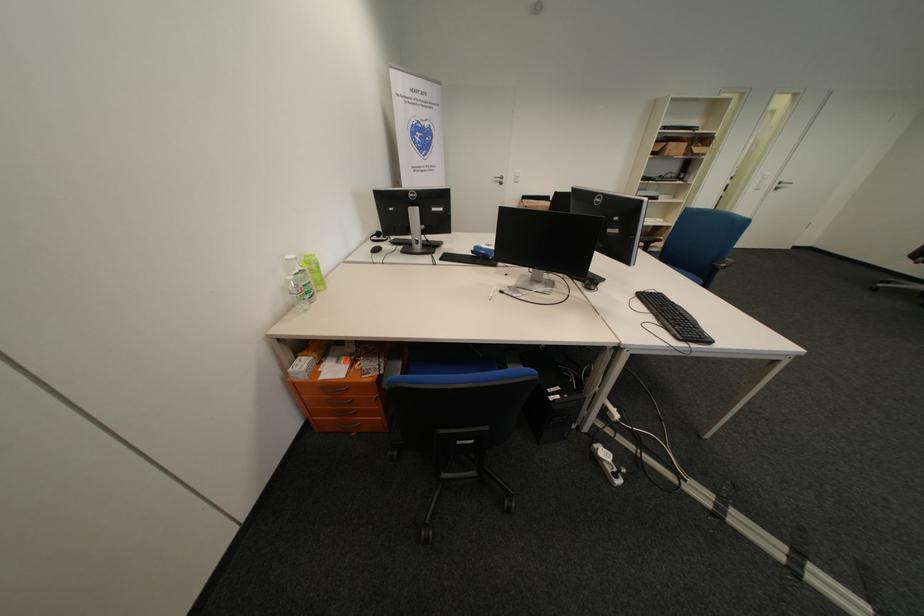
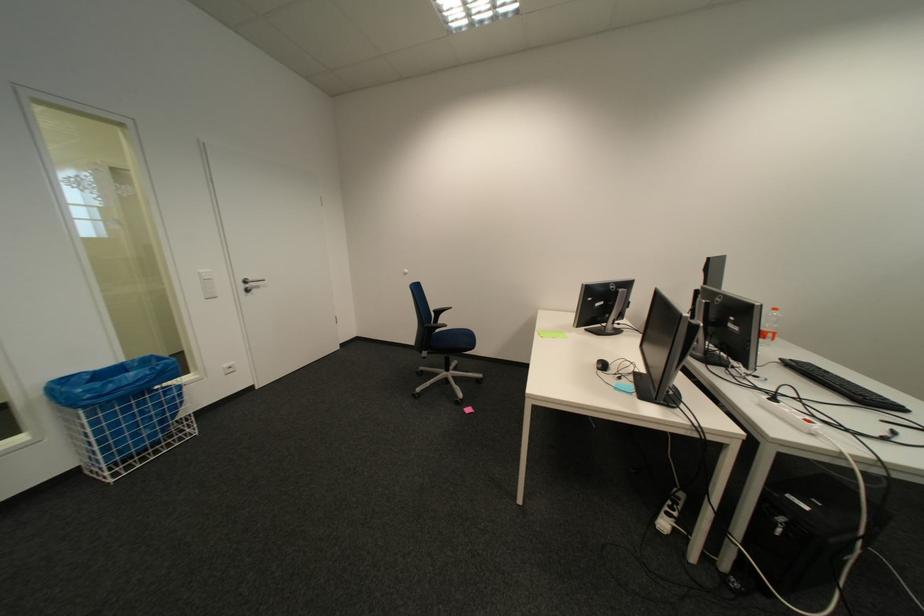
Locate, in the second image, the point that corresponds to (787,187) in the first image.

(254, 286)